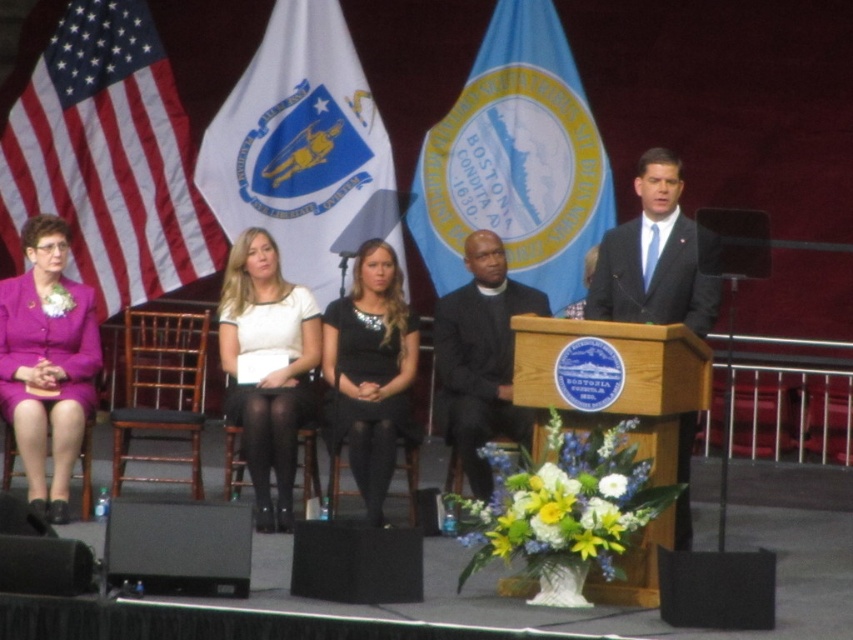
Question: Can you confirm if black satin dress at center is positioned to the left of black matte suit at center?

Choices:
 (A) no
 (B) yes

Answer: (B)

Question: Is red-white striped flag at left positioned in front of white matte dress at center?

Choices:
 (A) no
 (B) yes

Answer: (A)

Question: Is red-white striped flag at left below purple satin suit at left?

Choices:
 (A) no
 (B) yes

Answer: (A)

Question: Among these objects, which one is nearest to the camera?

Choices:
 (A) purple satin suit at left
 (B) black satin dress at center
 (C) blue fabric flag at center

Answer: (B)

Question: Which object is closer to the camera taking this photo?

Choices:
 (A) white fabric flag at center
 (B) red-white striped flag at left

Answer: (A)

Question: Among these objects, which one is nearest to the camera?

Choices:
 (A) black matte speaker at lower left
 (B) white fabric flag at center
 (C) dark suit at center
 (D) black matte suit at center

Answer: (A)